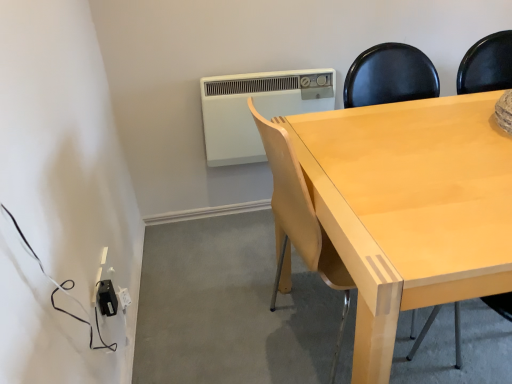
You are a GUI agent. You are given a task and a screenshot of the screen. Output one action in this format:
    pyautogui.click(x=<x>, y=<y>)
    Task: Click on the free space to the back side of light wood chair at center
    
    Given the screenshot: What is the action you would take?
    pyautogui.click(x=282, y=292)